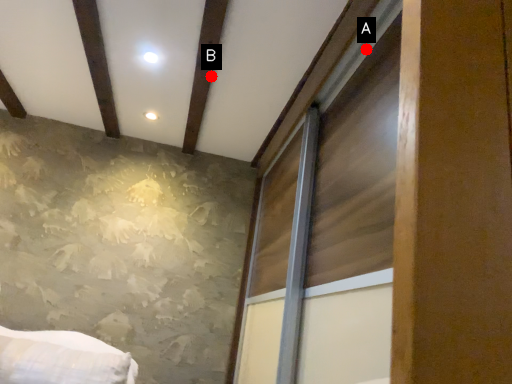
Question: Two points are circled on the image, labeled by A and B beside each circle. Which point is farther to the camera?

Choices:
 (A) A is further
 (B) B is further

Answer: (B)